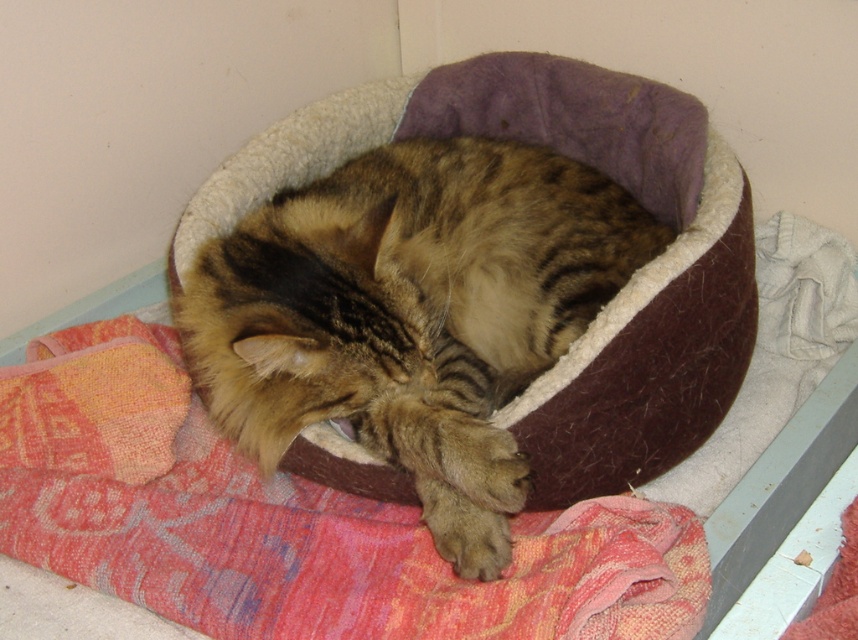
You are a photographer aiming to capture a clear shot of the tabby fur cat at center and the textured pink fabric at lower center. Which object should you focus on first to ensure it appears sharp in the photo?

You should focus on the tabby fur cat at center first because it is closer to you than the textured pink fabric at lower center, so focusing on the closer object ensures it will be sharp.

You are a pet owner trying to choose a new bed for your tabby fur cat at center. The store has a bed made of textured pink fabric at lower center. Based on the size comparison between the cat and the bed, will the bed be large enough for the cat to stretch out comfortably?

The tabby fur cat at center is narrower than the textured pink fabric at lower center, so the bed should be large enough for the cat to stretch out comfortably.

You are a pet owner who wants to ensure the tabby fur cat at center has enough space to stretch out comfortably. Given the size comparison between the cat and the textured pink fabric at lower center, can you determine if the cat has sufficient space on the bed?

The tabby fur cat at center is larger than the textured pink fabric at lower center, so it may not have enough space to stretch out comfortably on the bed.